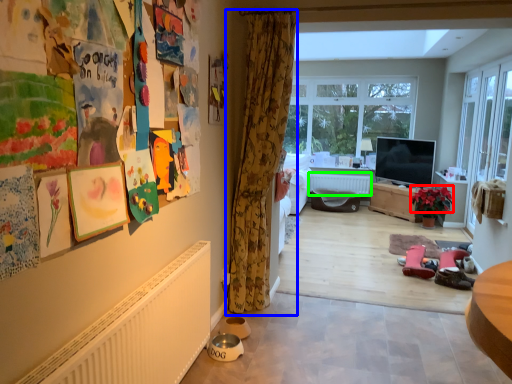
Question: Estimate the real-world distances between objects in this image. Which object is farther from flower (highlighted by a red box), curtain (highlighted by a blue box) or radiator (highlighted by a green box)?

Choices:
 (A) curtain
 (B) radiator

Answer: (A)